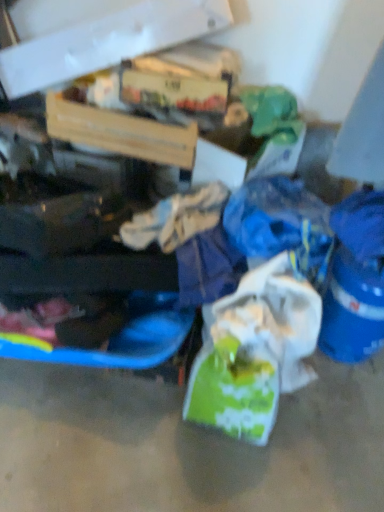
Question: Is blue plastic bucket at lower right closer to the viewer compared to wooden crate at upper center, which ranks as the second box in top-to-bottom order?

Choices:
 (A) yes
 (B) no

Answer: (A)

Question: From the image's perspective, is blue plastic bucket at lower right on top of wooden crate at upper center, which is the 1th box from bottom to top?

Choices:
 (A) no
 (B) yes

Answer: (A)

Question: From a real-world perspective, is blue plastic bucket at lower right under wooden crate at upper center, which ranks as the second box in top-to-bottom order?

Choices:
 (A) no
 (B) yes

Answer: (B)

Question: Considering the relative sizes of blue plastic bucket at lower right and wooden crate at upper center, which ranks as the second box in top-to-bottom order, in the image provided, is blue plastic bucket at lower right smaller than wooden crate at upper center, which ranks as the second box in top-to-bottom order,?

Choices:
 (A) yes
 (B) no

Answer: (A)

Question: Considering the relative sizes of blue plastic bucket at lower right and wooden crate at upper center, which is the 1th box from bottom to top, in the image provided, is blue plastic bucket at lower right taller than wooden crate at upper center, which is the 1th box from bottom to top,?

Choices:
 (A) yes
 (B) no

Answer: (A)

Question: Can you confirm if blue plastic bucket at lower right is bigger than wooden crate at upper center, which is the 1th box from bottom to top?

Choices:
 (A) no
 (B) yes

Answer: (A)

Question: Considering the relative sizes of white matte plastic bag at center and wooden crate at upper center, which ranks as the second box in top-to-bottom order, in the image provided, is white matte plastic bag at center thinner than wooden crate at upper center, which ranks as the second box in top-to-bottom order,?

Choices:
 (A) no
 (B) yes

Answer: (B)

Question: From the image's perspective, is white matte plastic bag at center located beneath wooden crate at upper center, which is the 1th box from bottom to top?

Choices:
 (A) yes
 (B) no

Answer: (A)

Question: Considering the relative sizes of white matte plastic bag at center and wooden crate at upper center, which is the 1th box from bottom to top, in the image provided, is white matte plastic bag at center bigger than wooden crate at upper center, which is the 1th box from bottom to top,?

Choices:
 (A) no
 (B) yes

Answer: (A)

Question: Is white matte plastic bag at center at the right side of wooden crate at upper center, which is the 1th box from bottom to top?

Choices:
 (A) no
 (B) yes

Answer: (B)

Question: Is the surface of white matte plastic bag at center in direct contact with wooden crate at upper center, which ranks as the second box in top-to-bottom order?

Choices:
 (A) no
 (B) yes

Answer: (A)

Question: Is white matte plastic bag at center to the left of wooden crate at upper center, which is the 1th box from bottom to top, from the viewer's perspective?

Choices:
 (A) yes
 (B) no

Answer: (B)

Question: Does white matte plastic bag at center appear on the left side of cardboard box at upper left, acting as the first box starting from the top?

Choices:
 (A) yes
 (B) no

Answer: (B)